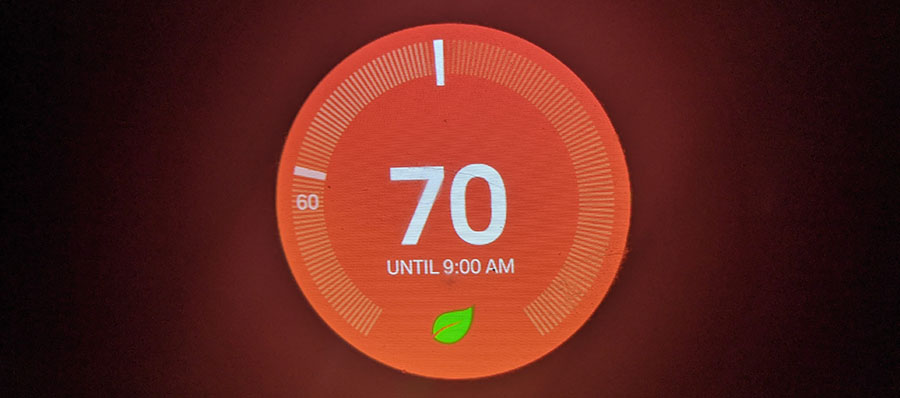
You are a GUI agent. You are given a task and a screenshot of the screen. Output one action in this format:
    pyautogui.click(x=<x>, y=<y>)
    Task: Click on the plant
    
    Given the screenshot: What is the action you would take?
    pyautogui.click(x=452, y=332)